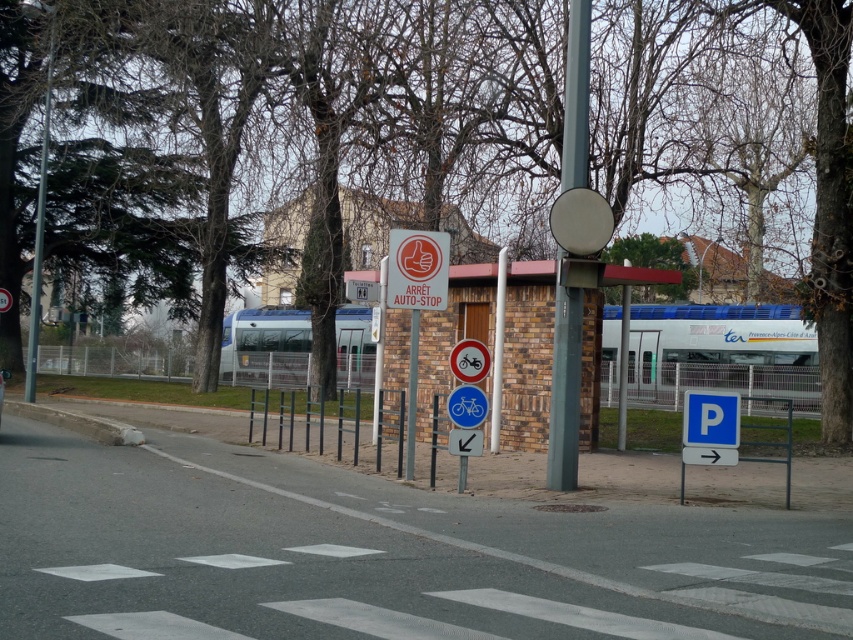
You are a delivery person trying to park your bicycle. You see a brick wall bus stop at center and a blue plastic bicycle at center. Where should you park your bicycle?

The blue plastic bicycle at center is already parked at the designated spot below the brick wall bus stop at center, so you should park your bicycle there as well.

Based on the photo, you are a photographer standing at the pedestrian crossing and want to take a photo of both the metal pole with the stop sign and the blue parking sign. The metal pole with the stop sign is located at point (463, 372) and the blue parking sign is at point (460, 401). Which object should you focus on first to ensure both are in focus?

You should focus on the metal pole with the stop sign at point (463, 372) first because it is closer to the camera than the blue parking sign at point (460, 401). This ensures both will be in focus as the closer object sets the focal plane.

You are a delivery person who needs to park your bicycle between the white plastic bicycle at center and the blue plastic bicycle at center. The parking space between them is 30.17 centimeters. If your bicycle is 30 centimeters wide, can you fit your bicycle there?

The distance between the white plastic bicycle at center and the blue plastic bicycle at center is 30.17 centimeters. Since your bicycle is 30 centimeters wide, it can fit with a small amount of space remaining.